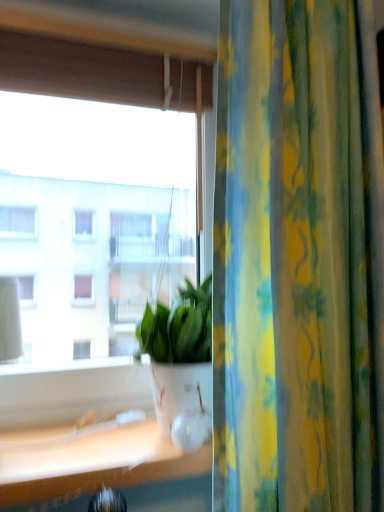
Question: From the image's perspective, would you say yellow-green floral fabric curtain at right is shown under transparent glass window at center?

Choices:
 (A) no
 (B) yes

Answer: (B)

Question: Is yellow-green floral fabric curtain at right positioned with its back to transparent glass window at center?

Choices:
 (A) no
 (B) yes

Answer: (B)

Question: Considering the relative sizes of yellow-green floral fabric curtain at right and transparent glass window at center in the image provided, is yellow-green floral fabric curtain at right thinner than transparent glass window at center?

Choices:
 (A) yes
 (B) no

Answer: (B)

Question: Does yellow-green floral fabric curtain at right have a larger size compared to transparent glass window at center?

Choices:
 (A) no
 (B) yes

Answer: (A)

Question: From a real-world perspective, is yellow-green floral fabric curtain at right located beneath transparent glass window at center?

Choices:
 (A) yes
 (B) no

Answer: (A)

Question: Is yellow-green floral fabric curtain at right aimed at transparent glass window at center?

Choices:
 (A) yes
 (B) no

Answer: (B)

Question: Can you confirm if white glossy pot at center is taller than yellow-green floral fabric curtain at right?

Choices:
 (A) yes
 (B) no

Answer: (B)

Question: From a real-world perspective, does white glossy pot at center stand above yellow-green floral fabric curtain at right?

Choices:
 (A) yes
 (B) no

Answer: (B)

Question: Is white glossy pot at center further to the viewer compared to yellow-green floral fabric curtain at right?

Choices:
 (A) yes
 (B) no

Answer: (A)

Question: From a real-world perspective, is white glossy pot at center beneath yellow-green floral fabric curtain at right?

Choices:
 (A) no
 (B) yes

Answer: (B)

Question: Is white glossy pot at center far away from yellow-green floral fabric curtain at right?

Choices:
 (A) yes
 (B) no

Answer: (B)

Question: Is white glossy pot at center thinner than yellow-green floral fabric curtain at right?

Choices:
 (A) no
 (B) yes

Answer: (A)

Question: Is yellow-green floral fabric curtain at right to the right of white glossy pot at center from the viewer's perspective?

Choices:
 (A) yes
 (B) no

Answer: (A)